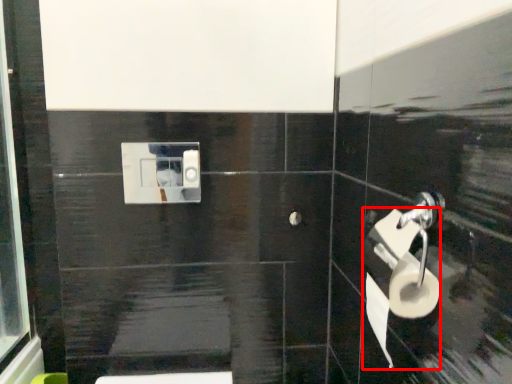
Question: In this image, where is toilet paper (annotated by the red box) located relative to toilet paper?

Choices:
 (A) right
 (B) left

Answer: (A)